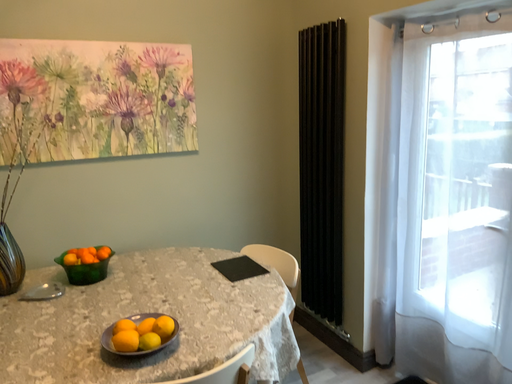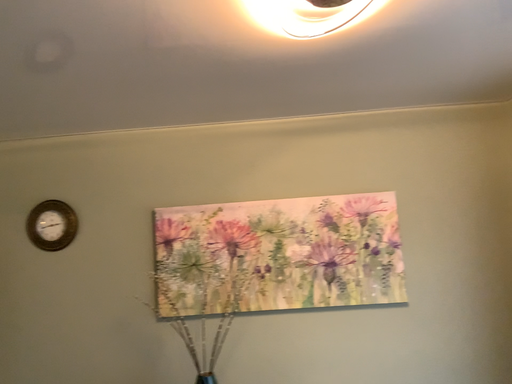
Question: How did the camera likely rotate when shooting the video?

Choices:
 (A) rotated downward
 (B) rotated upward

Answer: (B)